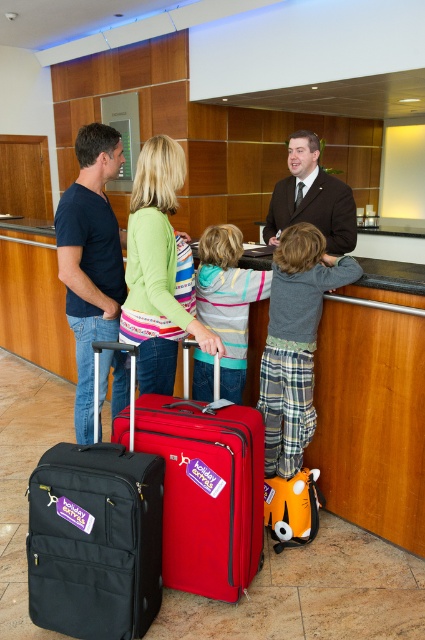
From the picture: Between matte red suitcase at center and dark brown suit at center, which one appears on the left side from the viewer's perspective?

From the viewer's perspective, matte red suitcase at center appears more on the left side.

Does matte red suitcase at center have a smaller size compared to dark brown suit at center?

Yes.

Identify the location of matte red suitcase at center. This screenshot has width=425, height=640. (206, 492).

This screenshot has width=425, height=640. In order to click on matte red suitcase at center in this screenshot , I will do `click(206, 492)`.

Who is shorter, black fabric suitcase at lower left or green striped sweater at center?

black fabric suitcase at lower left

The width and height of the screenshot is (425, 640). I want to click on black fabric suitcase at lower left, so click(96, 532).

Can you confirm if black fabric suitcase at lower left is positioned to the left of gray flannel pajama pants at center?

Indeed, black fabric suitcase at lower left is positioned on the left side of gray flannel pajama pants at center.

Which is more to the left, black fabric suitcase at lower left or gray flannel pajama pants at center?

black fabric suitcase at lower left is more to the left.

This screenshot has width=425, height=640. Identify the location of black fabric suitcase at lower left. (96, 532).